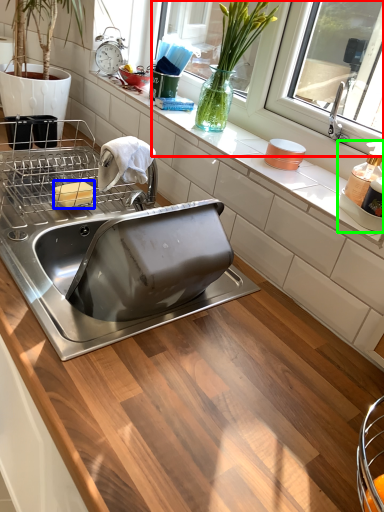
Question: Estimate the real-world distances between objects in this image. Which object is closer to window screen (highlighted by a red box), food (highlighted by a blue box) or appliance (highlighted by a green box)?

Choices:
 (A) food
 (B) appliance

Answer: (B)